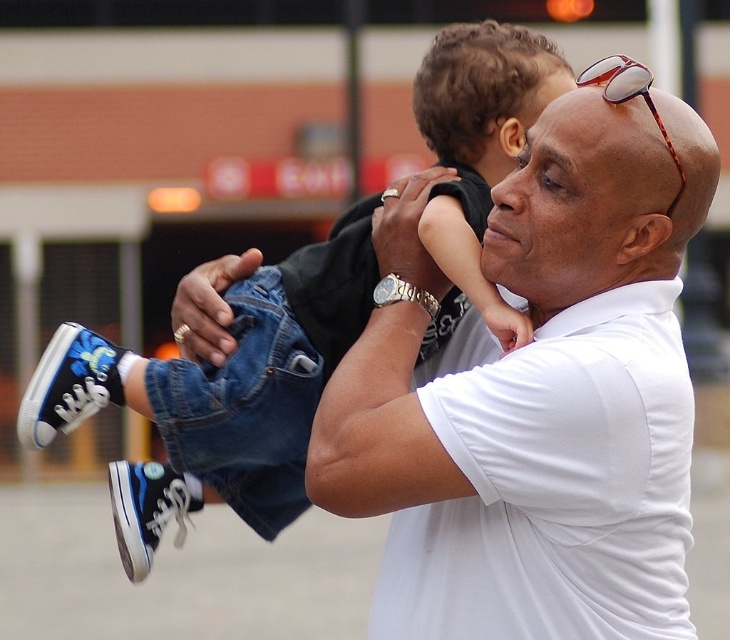
You are a photographer standing in front of the scene. You want to focus on the white matte shirt at center and the blue canvas sneakers at center. Which one is nearer to you?

The white matte shirt at center is closer to the viewer than the blue canvas sneakers at center.

You are standing at the position of the adult holding the child in the image. You want to place the white matte shirt at center on a hanger that is 13 meters away. Can you reach it without moving?

The distance between the adult holding the child and the white matte shirt at center is 13.22 meters, so no, you cannot reach the hanger 13 meters away without moving since the distance is slightly more than 13 meters.